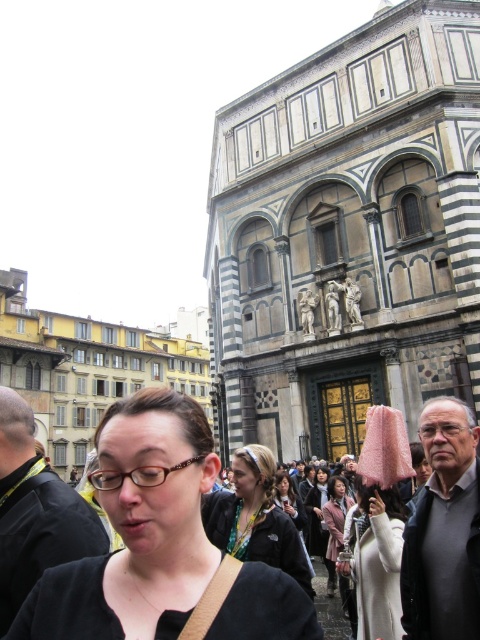
You are standing at the point marked as point (35, 512) in the image. What object are you currently standing on?

You are standing on the black fabric jacket at lower left.